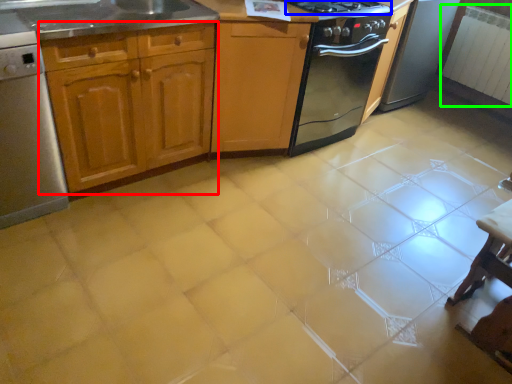
Question: Based on their relative distances, which object is nearer to cabinetry (highlighted by a red box)? Choose from gas stove (highlighted by a blue box) and radiator (highlighted by a green box).

Choices:
 (A) gas stove
 (B) radiator

Answer: (A)